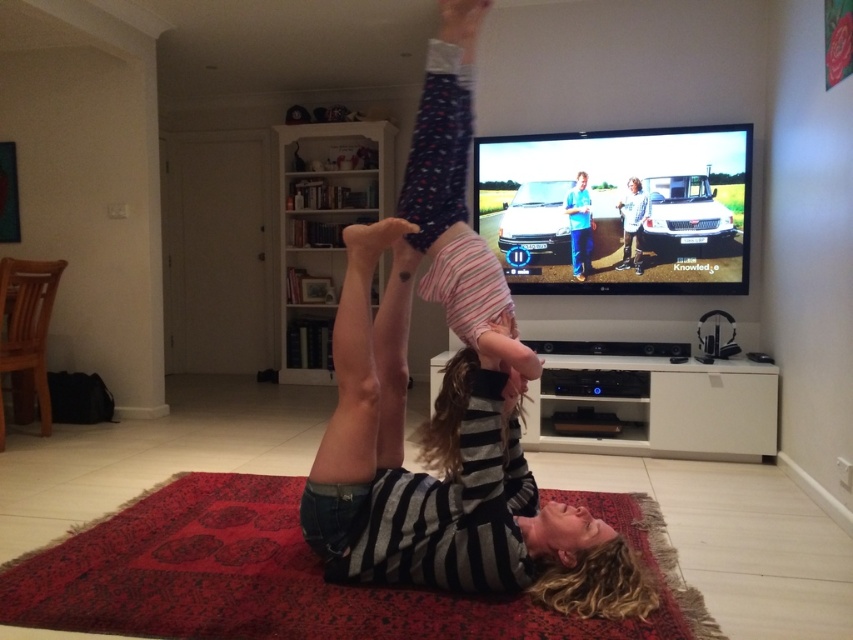
You are standing at the origin point of the coordinate system. You want to move to the red carpet at center. Which direction should you move in?

The red carpet at center is located at coordinate point 0.900 in the x direction and 0.345 in the y direction. Therefore, you should move towards the right and slightly forward to reach it.

You are a photographer trying to capture the striped fabric person at center and the blue jeans at upper center in the same frame. Based on their positions, which object is closer to the camera?

The striped fabric person at center is located below blue jeans at upper center, so the blue jeans at upper center is closer to the camera because objects higher up in the frame are typically closer in such compositions.